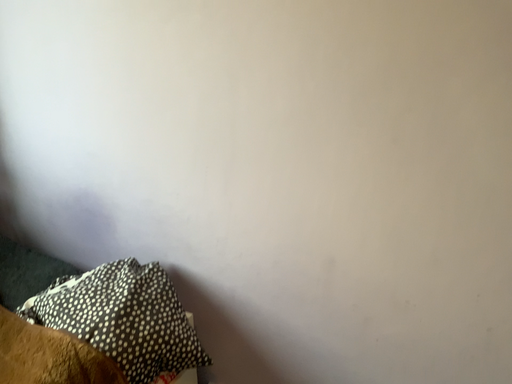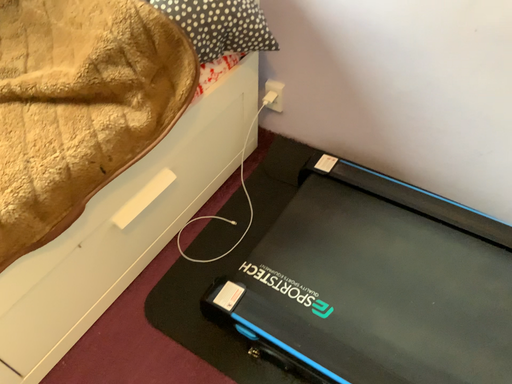
Question: Which way did the camera rotate in the video?

Choices:
 (A) rotated downward
 (B) rotated upward

Answer: (A)